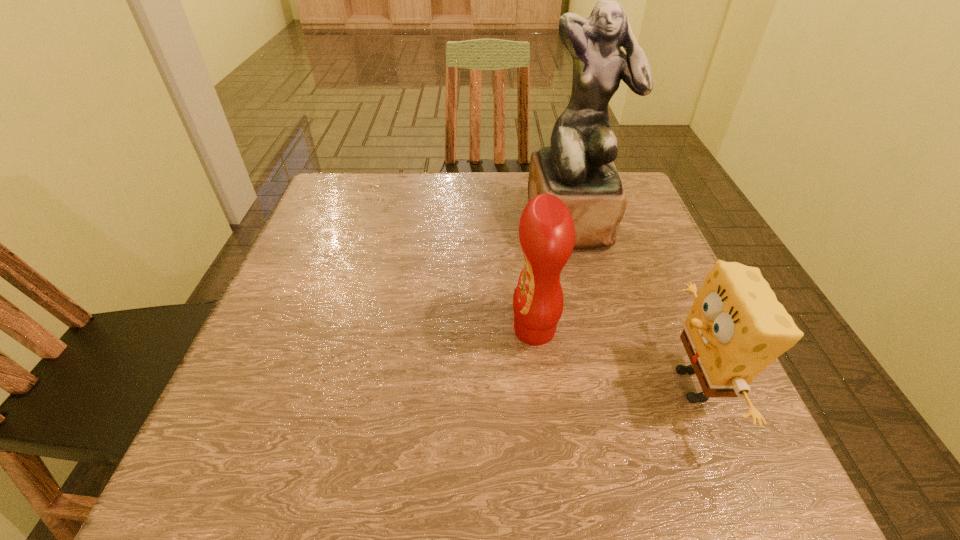
Image resolution: width=960 pixels, height=540 pixels. I want to click on object that stands as the second closest to the sponge, so click(577, 167).

Locate which object is the closest to the tallest object. Please provide its 2D coordinates. Your answer should be formatted as a tuple, i.e. [(x, y)], where the tuple contains the x and y coordinates of a point satisfying the conditions above.

[(546, 230)]

This screenshot has width=960, height=540. In order to click on free space that satisfies the following two spatial constraints: 1. in a relaxed pose on the tallest object; 2. on the label side of the condiment in this screenshot , I will do `click(600, 330)`.

Identify the location of vacant position in the image that satisfies the following two spatial constraints: 1. in a relaxed pose on the tallest object; 2. on the label side of the second shortest object. (600, 330).